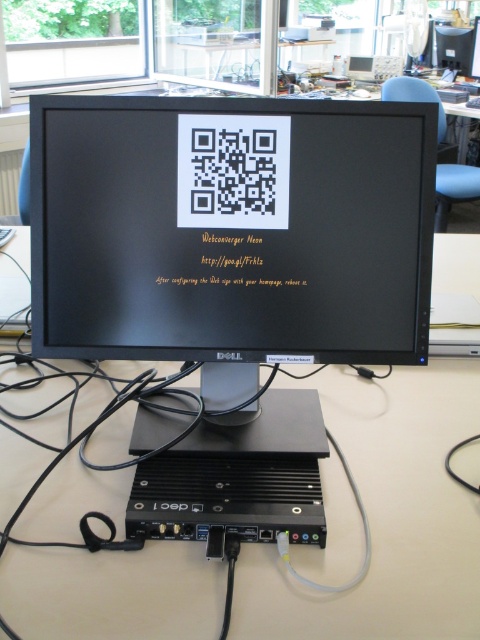
Question: Is black glossy monitor at center above black plastic computer at lower center?

Choices:
 (A) yes
 (B) no

Answer: (A)

Question: Can you confirm if beige plastic table at center is bigger than black plastic computer at lower center?

Choices:
 (A) yes
 (B) no

Answer: (A)

Question: Does black glossy monitor at center appear on the right side of black plastic computer at lower center?

Choices:
 (A) yes
 (B) no

Answer: (B)

Question: Which object is positioned farthest from the black plastic computer at lower center?

Choices:
 (A) beige plastic table at center
 (B) black glossy monitor at center

Answer: (B)

Question: Which is farther from the black glossy monitor at center?

Choices:
 (A) black plastic computer at lower center
 (B) beige plastic table at center

Answer: (B)

Question: Considering the real-world distances, which object is farthest from the black plastic computer at lower center?

Choices:
 (A) black glossy monitor at center
 (B) beige plastic table at center

Answer: (A)